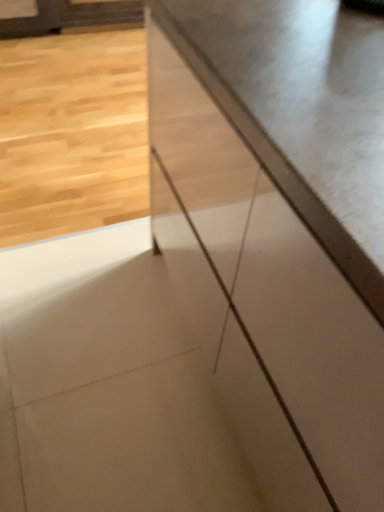
You are a GUI agent. You are given a task and a screenshot of the screen. Output one action in this format:
    pyautogui.click(x=<x>, y=<y>)
    Task: Click on the satin silver cabinet at center
    The width and height of the screenshot is (384, 512).
    Given the screenshot: What is the action you would take?
    pyautogui.click(x=279, y=229)

Describe the element at coordinates (279, 229) in the screenshot. I see `satin silver cabinet at center` at that location.

Identify the location of satin silver cabinet at center. The image size is (384, 512). (279, 229).